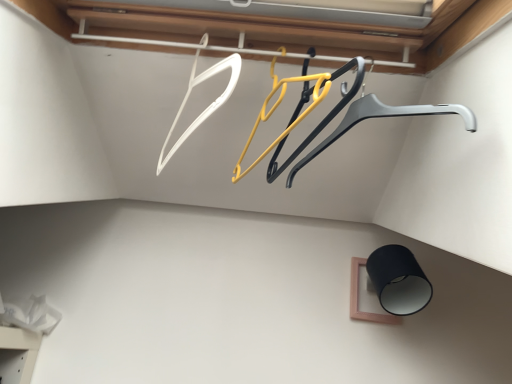
Describe the element at coordinates (208, 106) in the screenshot. The height and width of the screenshot is (384, 512). I see `white plastic hanger at upper left` at that location.

What is the approximate height of white plastic hanger at upper left?

white plastic hanger at upper left is 9.60 inches tall.

Where is `white plastic hanger at upper left`? This screenshot has height=384, width=512. white plastic hanger at upper left is located at coordinates (208, 106).

Locate an element on the screen. white plastic hanger at upper left is located at coordinates (208, 106).